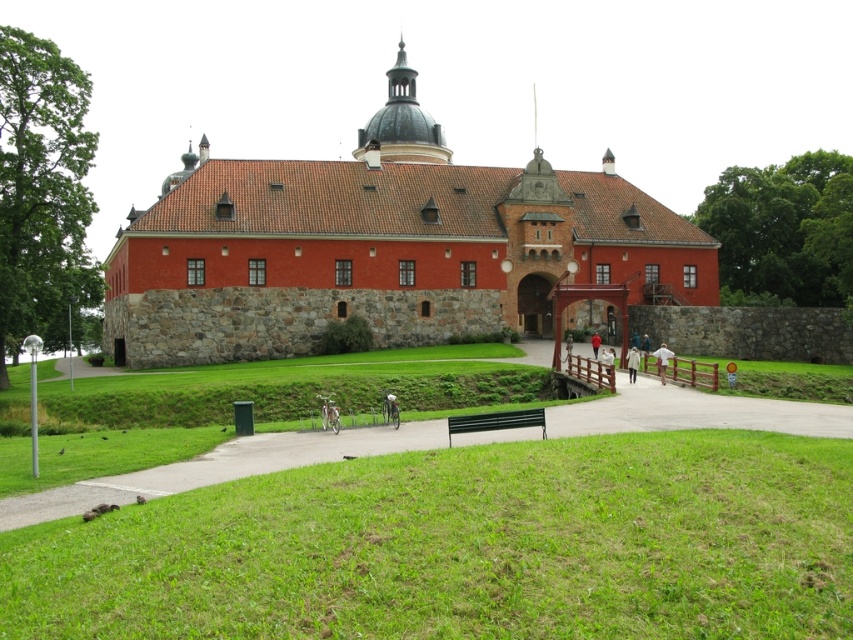
Question: Can you confirm if green grass at lower center is thinner than black plastic bench at lower center?

Choices:
 (A) no
 (B) yes

Answer: (A)

Question: Which point is closer to the camera?

Choices:
 (A) (525, 412)
 (B) (155, 499)

Answer: (B)

Question: Among these points, which one is farthest from the camera?

Choices:
 (A) (518, 419)
 (B) (786, 561)

Answer: (A)

Question: Is green grass at lower center to the left of black plastic bench at lower center from the viewer's perspective?

Choices:
 (A) yes
 (B) no

Answer: (A)

Question: Can you confirm if green grass at lower center is smaller than black plastic bench at lower center?

Choices:
 (A) no
 (B) yes

Answer: (A)